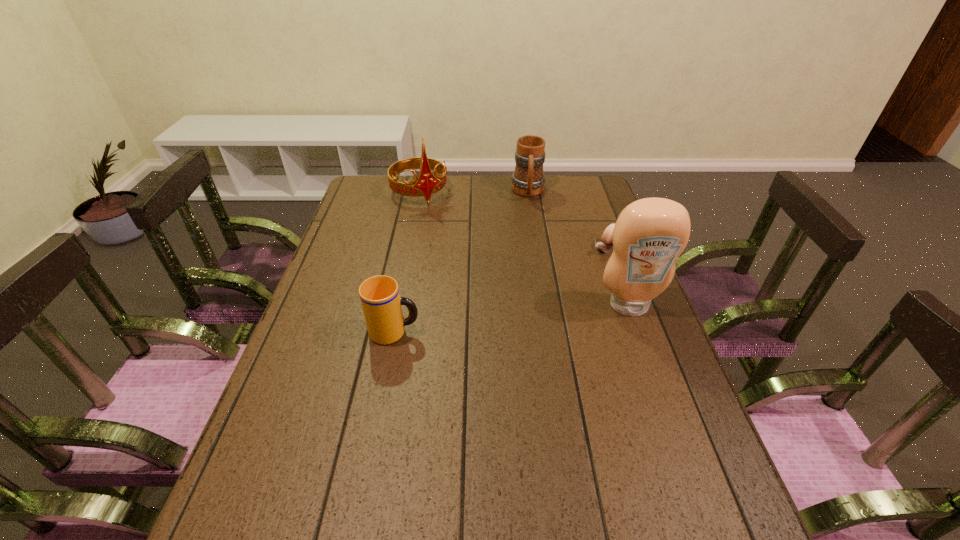
Locate an element on the screen. The width and height of the screenshot is (960, 540). object that is at the left edge is located at coordinates (427, 183).

Identify the location of condiment located at the right edge. 649,235.

Where is `escargot that is at the right edge`? This screenshot has height=540, width=960. escargot that is at the right edge is located at coordinates (606, 245).

Where is `object that is at the far left corner`? The height and width of the screenshot is (540, 960). object that is at the far left corner is located at coordinates (427, 183).

Locate an element on the screen. The image size is (960, 540). vacant space at the far edge of the desktop is located at coordinates (535, 208).

Locate an element on the screen. The width and height of the screenshot is (960, 540). blank space at the left edge of the desktop is located at coordinates (310, 312).

Image resolution: width=960 pixels, height=540 pixels. I want to click on vacant space at the right edge of the desktop, so click(x=578, y=218).

Where is `free region at the far left corner`? Image resolution: width=960 pixels, height=540 pixels. free region at the far left corner is located at coordinates (397, 194).

Identify the location of vacant space at the near left corner of the desktop. The image size is (960, 540). (230, 495).

In the image, there is a desktop. Where is `free space at the far right corner`? Image resolution: width=960 pixels, height=540 pixels. free space at the far right corner is located at coordinates (588, 184).